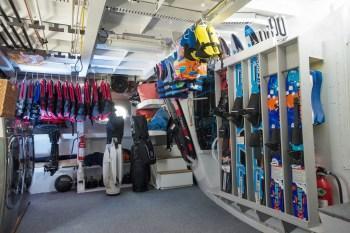
This screenshot has height=233, width=350. What are the coordinates of `washing machine` in the screenshot? It's located at (64, 182), (5, 193), (27, 174).